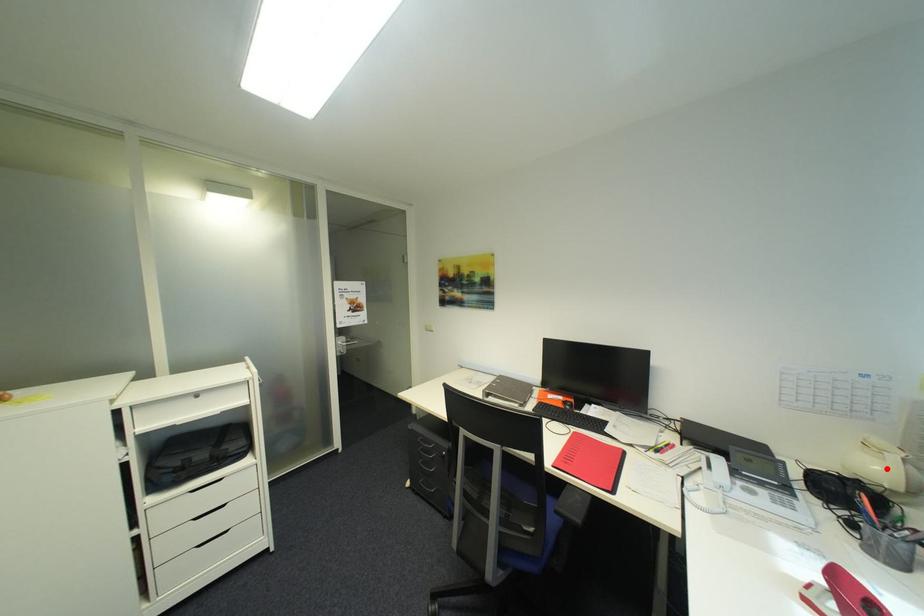
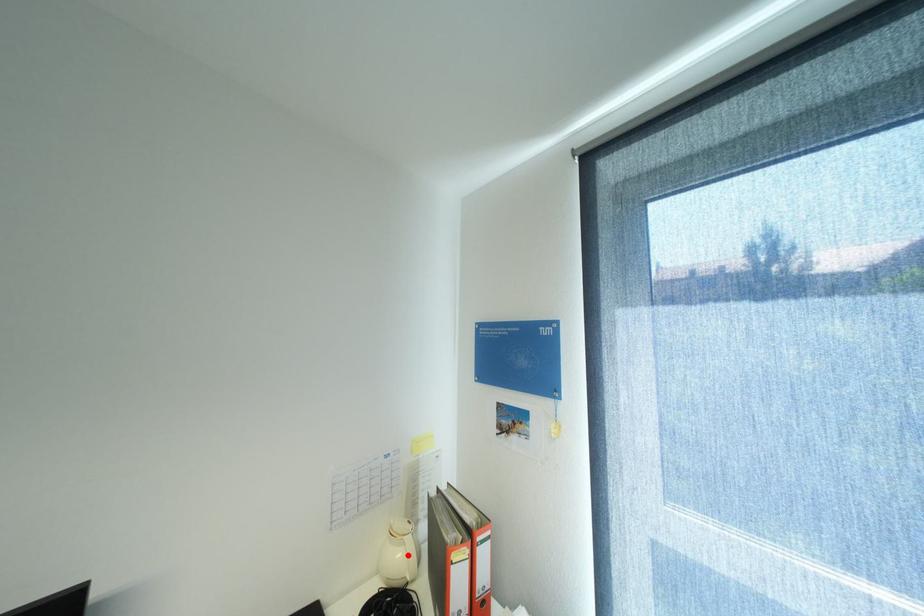
I am providing you with two images of the same scene from different viewpoints. A red point is marked on the first image and another point is marked on the second image. Is the marked point in image1 the same physical position as the marked point in image2?

Yes